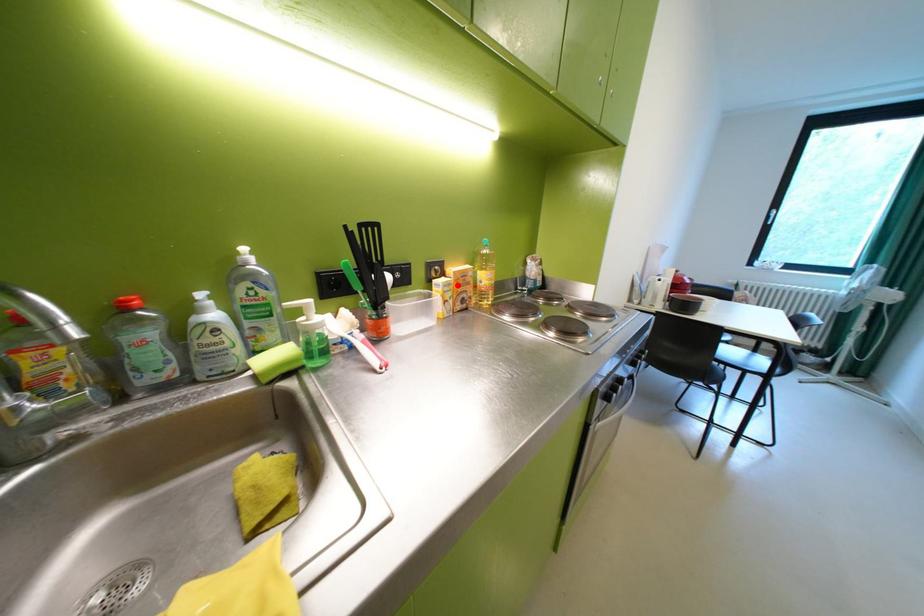
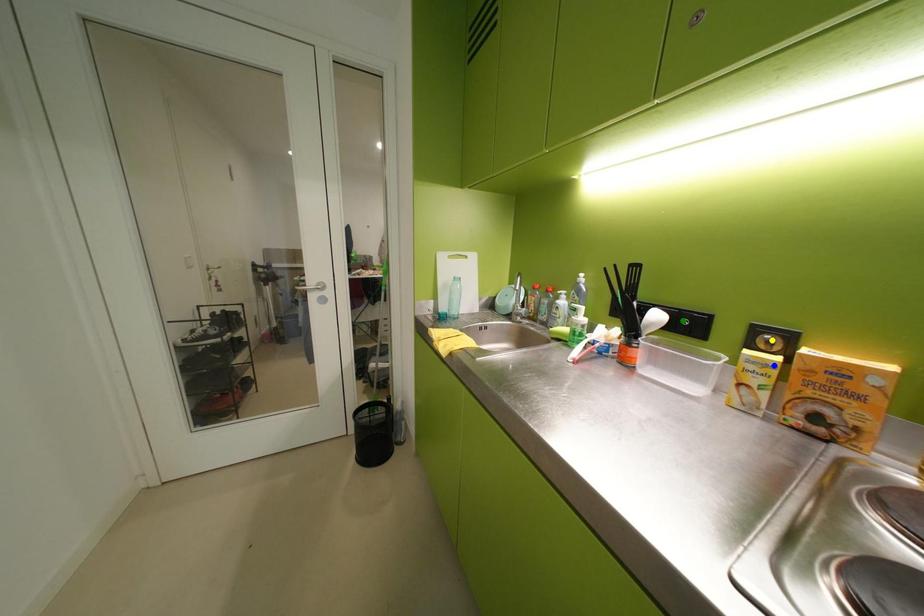
Question: I am providing you with two images of the same scene from different viewpoints. A red point is marked on the first image. You are given multiple points on the second image. Which point in image 2 is actually the same real-world point as the red point in image 1?

Choices:
 (A) yellow point
 (B) green point
 (C) blue point

Answer: (C)